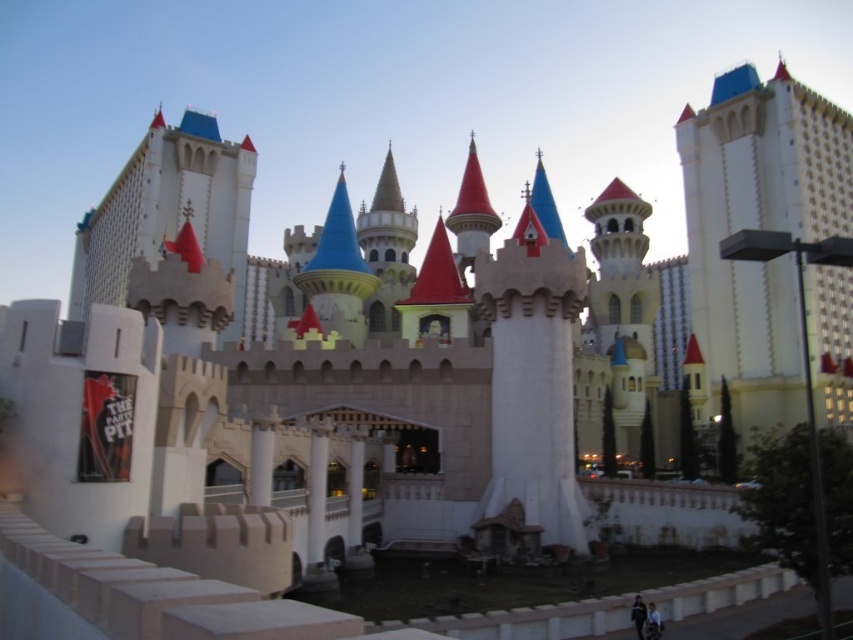
You are standing in the fairytale landscape and see the white stone castle at right and the white stone castle at upper left. Which castle is positioned lower in the image?

The white stone castle at right is positioned lower than the white stone castle at upper left.

You are standing at the center of the image and want to locate the white stone castle at right. Which direction should you look to find it?

The white stone castle at right is located at coordinates 0.358 on the x axis and 0.892 on the y axis. Since you are at the center, you should look to the right and upwards to find it.